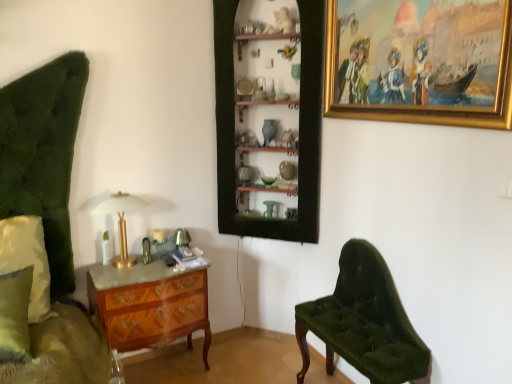
Question: From the image's perspective, would you say wooden shelves at center is shown under gold-framed painting at upper right?

Choices:
 (A) no
 (B) yes

Answer: (B)

Question: Is the depth of wooden shelves at center greater than that of gold-framed painting at upper right?

Choices:
 (A) yes
 (B) no

Answer: (A)

Question: Is wooden shelves at center smaller than gold-framed painting at upper right?

Choices:
 (A) yes
 (B) no

Answer: (B)

Question: Are wooden shelves at center and gold-framed painting at upper right far apart?

Choices:
 (A) yes
 (B) no

Answer: (B)

Question: Considering the relative sizes of wooden shelves at center and gold-framed painting at upper right in the image provided, is wooden shelves at center bigger than gold-framed painting at upper right?

Choices:
 (A) yes
 (B) no

Answer: (A)

Question: Would you say gold-framed painting at upper right is to the left or to the right of velvet green bench at lower right in the picture?

Choices:
 (A) right
 (B) left

Answer: (A)

Question: Considering the positions of point (413, 109) and point (359, 312), is point (413, 109) closer or farther from the camera than point (359, 312)?

Choices:
 (A) farther
 (B) closer

Answer: (B)

Question: From a real-world perspective, is gold-framed painting at upper right positioned above or below velvet green bench at lower right?

Choices:
 (A) below
 (B) above

Answer: (B)

Question: Is gold-framed painting at upper right situated inside velvet green bench at lower right or outside?

Choices:
 (A) outside
 (B) inside

Answer: (A)

Question: Does point (338, 288) appear closer or farther from the camera than point (134, 324)?

Choices:
 (A) farther
 (B) closer

Answer: (A)

Question: Based on their positions, is velvet green bench at lower right located to the left or right of wooden marquetry chest of drawers at lower left?

Choices:
 (A) right
 (B) left

Answer: (A)

Question: Is velvet green bench at lower right in front of or behind wooden marquetry chest of drawers at lower left in the image?

Choices:
 (A) front
 (B) behind

Answer: (A)

Question: Considering the positions of velvet green bench at lower right and wooden marquetry chest of drawers at lower left in the image, is velvet green bench at lower right bigger or smaller than wooden marquetry chest of drawers at lower left?

Choices:
 (A) small
 (B) big

Answer: (B)

Question: Considering the positions of point (480, 97) and point (133, 195), is point (480, 97) closer or farther from the camera than point (133, 195)?

Choices:
 (A) farther
 (B) closer

Answer: (B)

Question: Based on their positions, is gold-framed painting at upper right located to the left or right of gold metallic table lamp at center?

Choices:
 (A) left
 (B) right

Answer: (B)